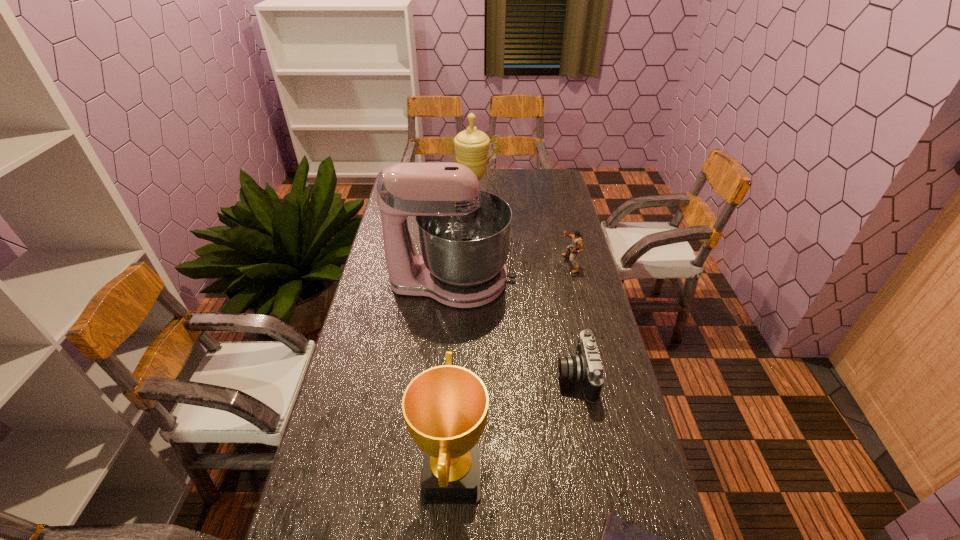
The height and width of the screenshot is (540, 960). In order to click on vacant space situated on the front-facing side of the third shortest object in this screenshot , I will do `click(517, 264)`.

This screenshot has height=540, width=960. Identify the location of vacant space located on the front-facing side of the third shortest object. pos(481,264).

Find the location of a particular element. This screenshot has height=540, width=960. free spot located 0.110m on the front-facing side of the fifth tallest object is located at coordinates (520, 376).

This screenshot has width=960, height=540. Identify the location of vacant space located 0.350m on the front-facing side of the fifth tallest object. (438, 376).

Identify the location of blank space located 0.280m on the front-facing side of the fifth tallest object. (462, 376).

What are the coordinates of `object located in the left edge section of the desktop` in the screenshot? It's located at (464, 232).

Identify the location of puncher that is at the right edge. This screenshot has width=960, height=540. (577, 246).

I want to click on camera situated at the right edge, so click(x=585, y=367).

This screenshot has height=540, width=960. Find the location of `free point at the far edge`. free point at the far edge is located at coordinates click(x=484, y=191).

Locate an element on the screen. Image resolution: width=960 pixels, height=540 pixels. free region at the left edge is located at coordinates (372, 258).